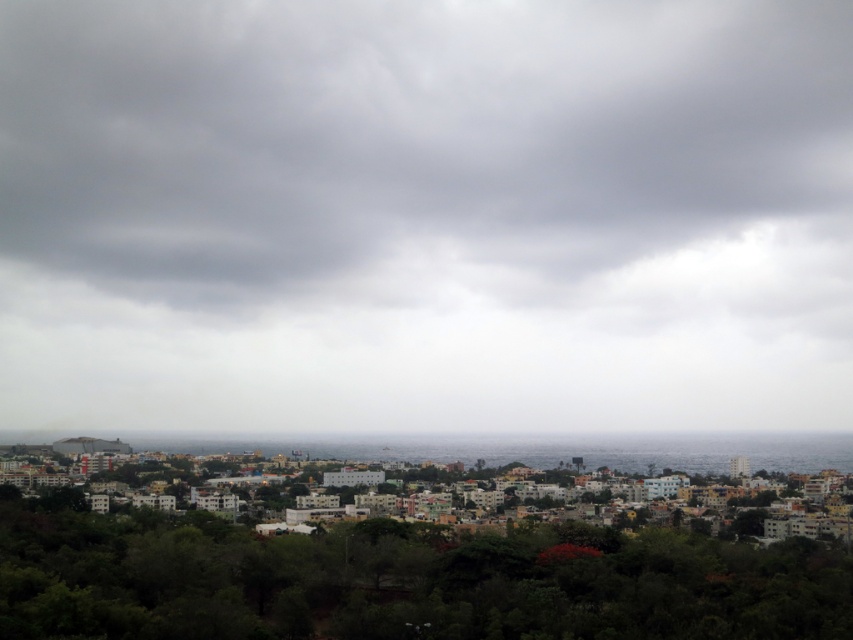
Question: Which point is farther to the camera?

Choices:
 (A) (236, 605)
 (B) (538, 17)

Answer: (B)

Question: Is gray cloudy sky at upper center thinner than green leafy trees at lower center?

Choices:
 (A) no
 (B) yes

Answer: (A)

Question: Which point appears closest to the camera in this image?

Choices:
 (A) (152, 13)
 (B) (62, 621)

Answer: (B)

Question: Which object is closer to the camera taking this photo?

Choices:
 (A) green leafy trees at lower center
 (B) gray cloudy sky at upper center

Answer: (B)

Question: Can you confirm if gray cloudy sky at upper center is bigger than green leafy trees at lower center?

Choices:
 (A) yes
 (B) no

Answer: (A)

Question: Can you confirm if gray cloudy sky at upper center is wider than green leafy trees at lower center?

Choices:
 (A) no
 (B) yes

Answer: (B)